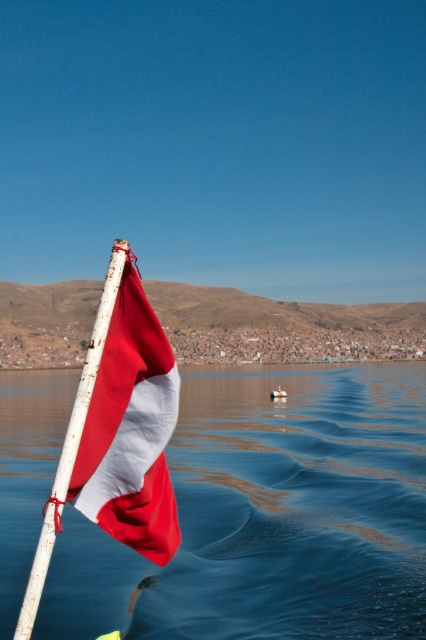
Measure the distance from matte fabric flag at left to white matte pole at left.

matte fabric flag at left is 20.78 inches away from white matte pole at left.

Between point (152, 484) and point (25, 588), which one is positioned in front?

Point (152, 484) is in front.

In order to click on matte fabric flag at left in this screenshot , I will do `click(131, 429)`.

Is blue water at lower left shorter than matte fabric flag at left?

In fact, blue water at lower left may be taller than matte fabric flag at left.

Describe the element at coordinates (268, 516) in the screenshot. I see `blue water at lower left` at that location.

Is point (291, 433) farther from camera compared to point (81, 481)?

Yes, point (291, 433) is farther from viewer.

Locate an element on the screen. The image size is (426, 640). blue water at lower left is located at coordinates (268, 516).

Which is more to the left, blue water at lower left or white matte pole at left?

From the viewer's perspective, blue water at lower left appears more on the left side.

Between blue water at lower left and white matte pole at left, which one has more height?

blue water at lower left is taller.

Find the location of `blue water at lower left`. blue water at lower left is located at coordinates [x=268, y=516].

Locate an element on the screen. Image resolution: width=426 pixels, height=640 pixels. blue water at lower left is located at coordinates (268, 516).